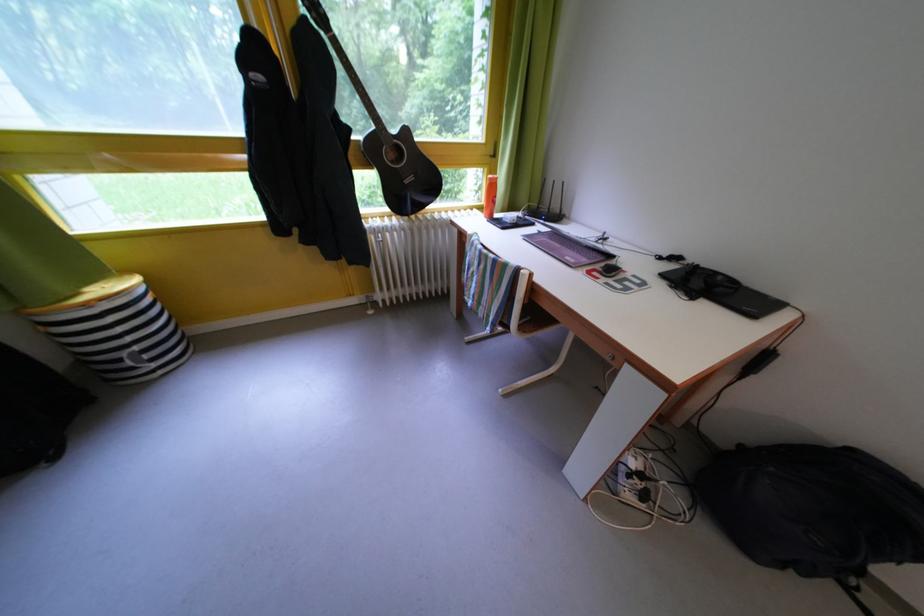
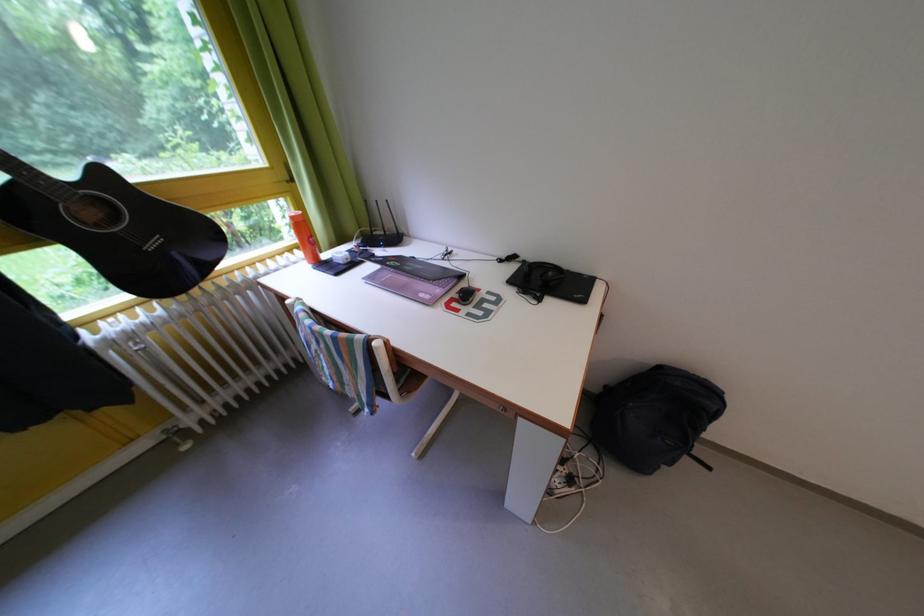
Find the pixel in the second image that matches (416,138) in the first image.

(112, 179)